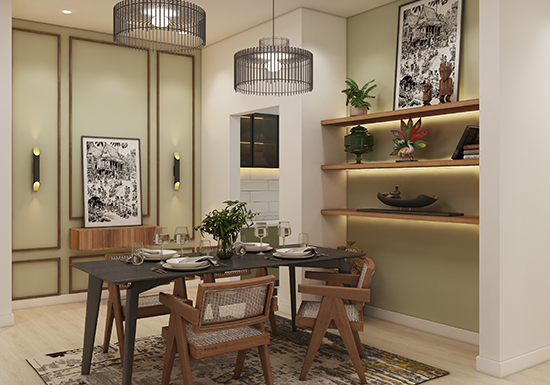
Identify the location of wall lights. The height and width of the screenshot is (385, 550). (33, 169), (173, 174).